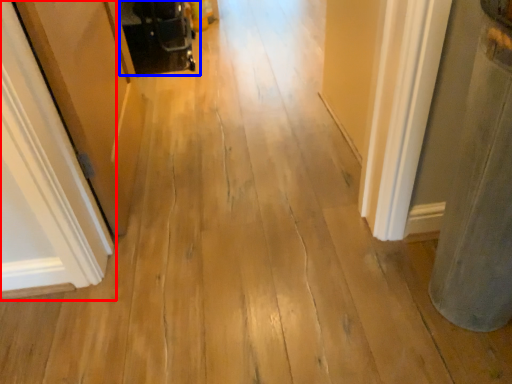
Question: Which of the following is the closest to the observer, door (highlighted by a red box) or baby carriage (highlighted by a blue box)?

Choices:
 (A) door
 (B) baby carriage

Answer: (A)